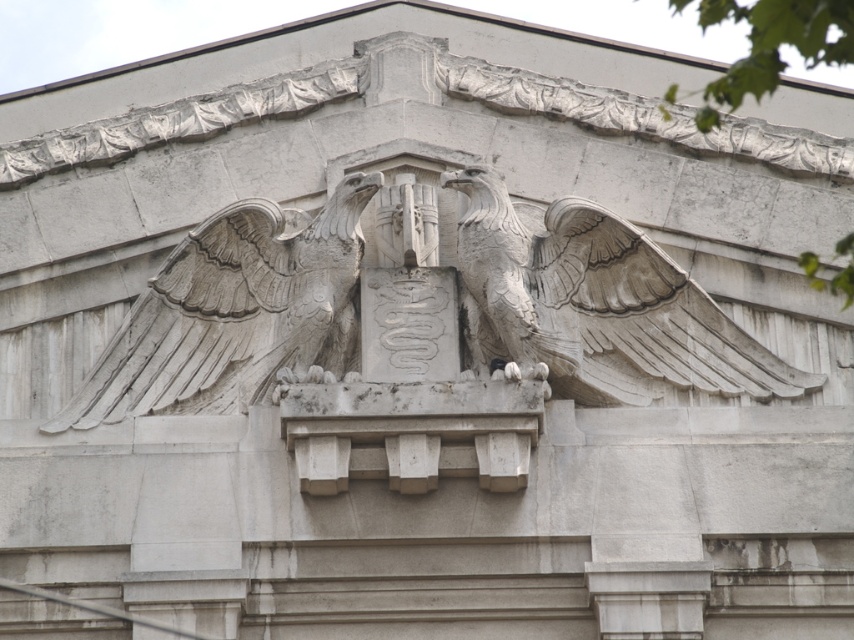
You are an architect examining the building facade. You need to place a small plaque exactly at the center of the gray stone eagle at center. What are the coordinates where you should place the plaque?

The coordinates for the center of the gray stone eagle at center are at point [234,312].

You are an architect examining the building facade. You notice two eagles carved into the stone relief. Which eagle, the white stone eagle at center or the gray stone eagle at center, is positioned higher up on the relief?

The white stone eagle at center is positioned higher up on the relief as it is located above the gray stone eagle at center.

You are an art conservator examining the building facade. You notice two eagles in the central relief. Which eagle, the white stone eagle at center or the gray stone eagle at center, is closer to you?

The white stone eagle at center is closer to you because it is in front of the gray stone eagle at center.